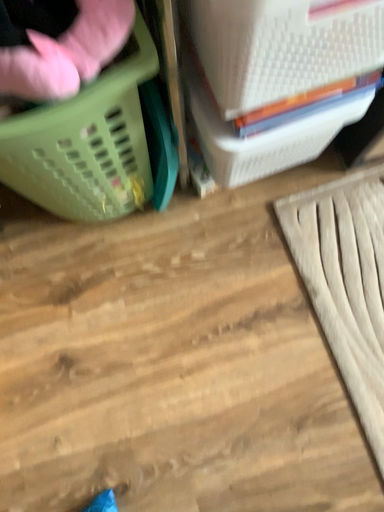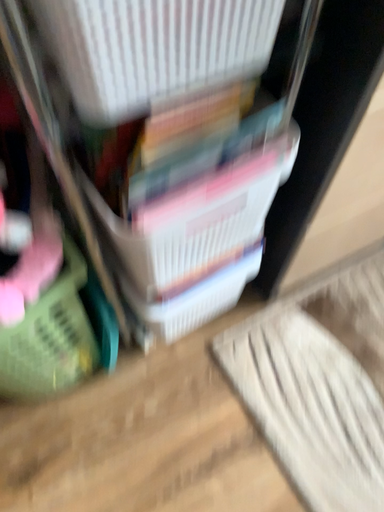
Question: How did the camera likely rotate when shooting the video?

Choices:
 (A) rotated upward
 (B) rotated downward

Answer: (A)